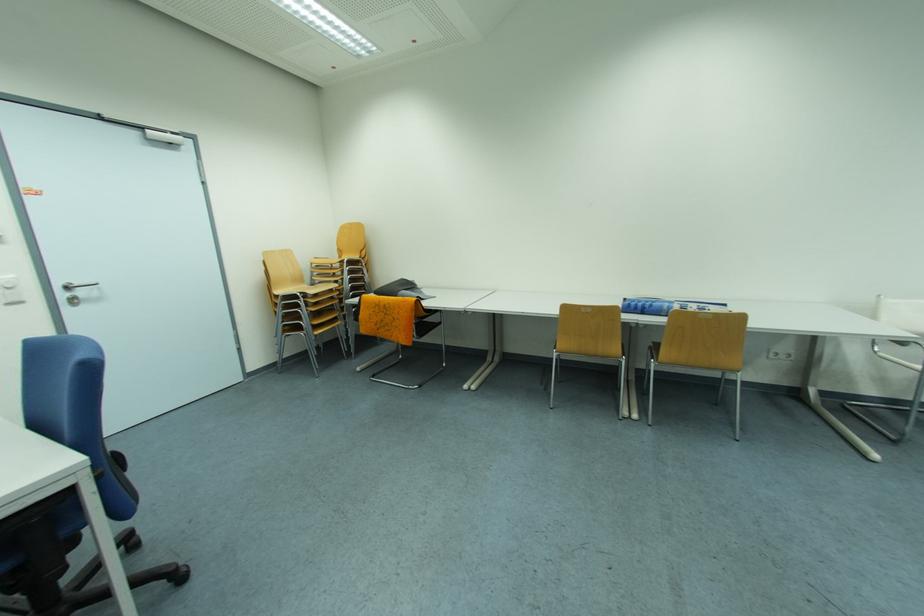
The image size is (924, 616). In order to click on white light switch in this screenshot , I will do `click(781, 354)`.